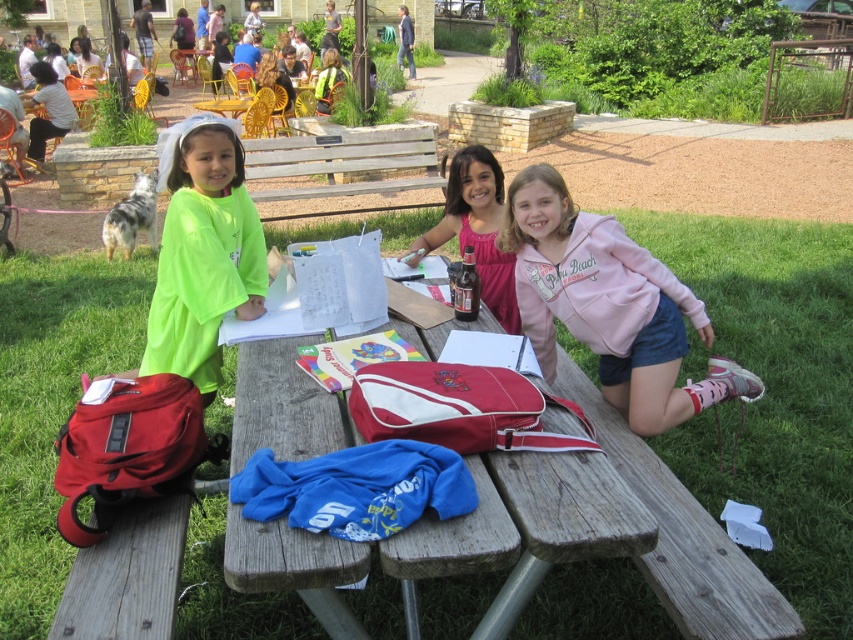
Question: Which of these objects is positioned farthest from the pink fabric shirt at center?

Choices:
 (A) pink fleece hoodie at center
 (B) neon green t-shirt at left

Answer: (B)

Question: Which point is farther to the camera?

Choices:
 (A) (190, 173)
 (B) (492, 208)
 (C) (512, 189)

Answer: (B)

Question: In this image, where is pink fleece hoodie at center located relative to pink fabric shirt at center?

Choices:
 (A) left
 (B) right

Answer: (B)

Question: Which point is closer to the camera taking this photo?

Choices:
 (A) click(515, 284)
 (B) click(430, 228)

Answer: (A)

Question: Observing the image, what is the correct spatial positioning of pink fleece hoodie at center in reference to neon green t-shirt at left?

Choices:
 (A) left
 (B) right

Answer: (B)

Question: Is pink fleece hoodie at center to the right of pink fabric shirt at center from the viewer's perspective?

Choices:
 (A) yes
 (B) no

Answer: (A)